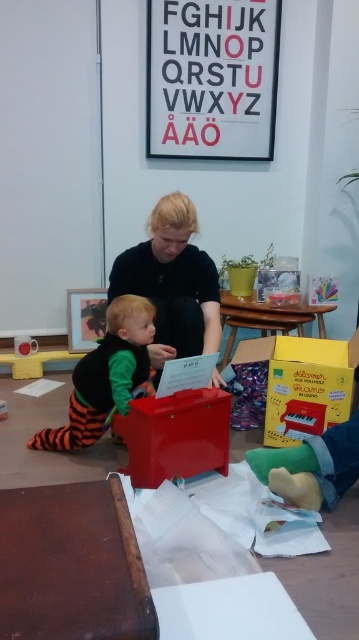
You are organizing a playroom and need to place the metallic red toy box at center and the orange striped fabric toddler at lower left. Given their sizes, which object requires more space?

The orange striped fabric toddler at lower left requires more space because the metallic red toy box at center occupies less space than it.

You are a parent trying to organize the playroom. The metallic red toy box at center is too small to store the orange striped fabric toddler at lower left. Can you confirm if the toy box is narrower than the toddler?

The metallic red toy box at center has a width less than the orange striped fabric toddler at lower left, so yes, the toy box is narrower than the toddler.

Consider the image. You are a parent trying to organize the playroom. You see the matte black sweater at center and the metallic red toy box at center. Which object is closer to you?

The matte black sweater at center is closer to you because the metallic red toy box at center is behind it.